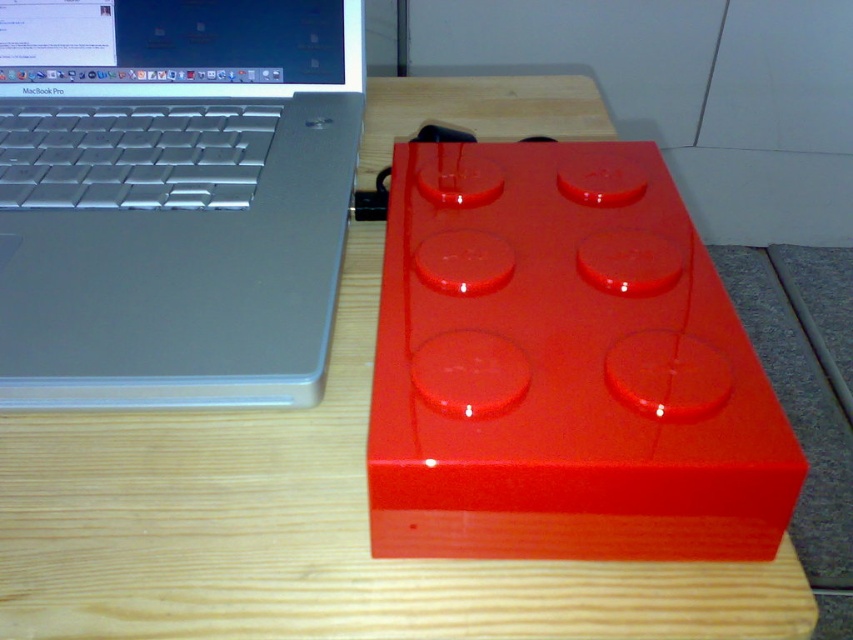
Between glossy plastic block at center and satin silver laptop at left, which one appears on the right side from the viewer's perspective?

glossy plastic block at center

Does glossy plastic block at center have a lesser height compared to satin silver laptop at left?

Yes.

Who is more distant from viewer, (677, 515) or (138, 221)?

The point (138, 221) is more distant.

Where is `glossy plastic block at center`? This screenshot has width=853, height=640. glossy plastic block at center is located at coordinates (563, 368).